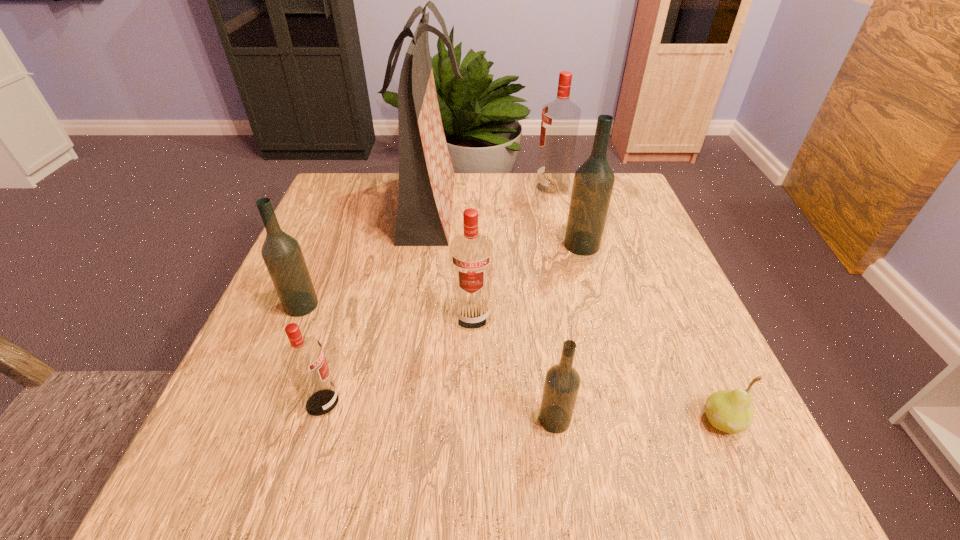
The height and width of the screenshot is (540, 960). What are the coordinates of `the nearest red vodka` in the screenshot? It's located at (303, 358).

Locate an element on the screen. The width and height of the screenshot is (960, 540). the fourth object from right to left is located at coordinates (562, 382).

Locate an element on the screen. the nearest black vodka is located at coordinates (562, 382).

This screenshot has height=540, width=960. I want to click on the shortest object, so click(x=731, y=411).

Where is `the rightmost object`? The width and height of the screenshot is (960, 540). the rightmost object is located at coordinates (731, 411).

The height and width of the screenshot is (540, 960). What are the coordinates of `free space located 0.140m on the front-facing side of the tallest object` in the screenshot? It's located at (521, 206).

The image size is (960, 540). I want to click on vacant space situated on the front label of the rightmost red vodka, so click(x=425, y=187).

The image size is (960, 540). I want to click on vacant space located 0.360m on the front label of the rightmost red vodka, so click(403, 187).

I want to click on free point located 0.170m on the front label of the rightmost red vodka, so click(x=472, y=187).

Find the location of a particular element. vacant space located on the front of the biggest black vodka is located at coordinates click(599, 308).